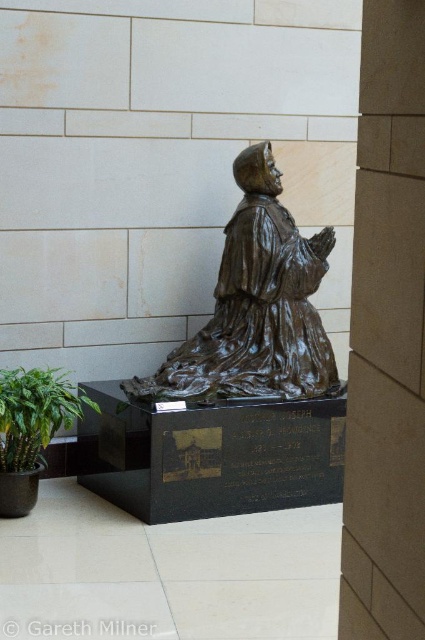
You are an interior designer planning to place a new decorative item between the brown stone pillar at center and the bronze statue at center. Considering their widths, which object should you position closer to the wall to ensure the decorative item fits comfortably in the space?

The brown stone pillar at center has a smaller width compared to the bronze statue at center. To ensure the decorative item fits comfortably between them, position the brown stone pillar at center closer to the wall since it takes up less space.

You are standing in front of the statue and want to take a photo of the plaque on the pedestal. The plaque is located at point (399, 140). If your camera can focus on objects up to 6 feet away, will you be able to focus on the plaque?

The distance of point (399, 140) from camera is 6.30 feet, which is beyond the camera focus limit of 6 feet. Therefore, the camera cannot focus on the plaque.